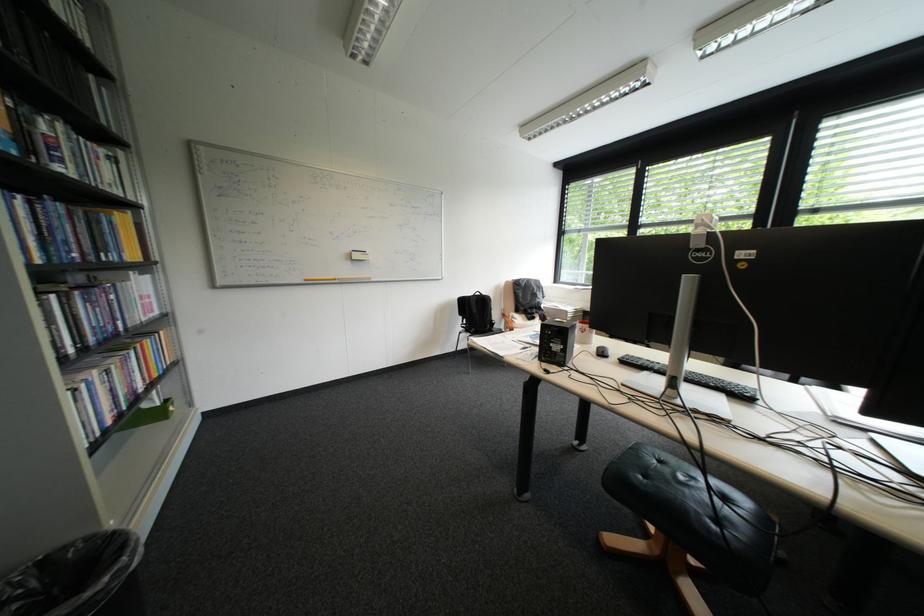
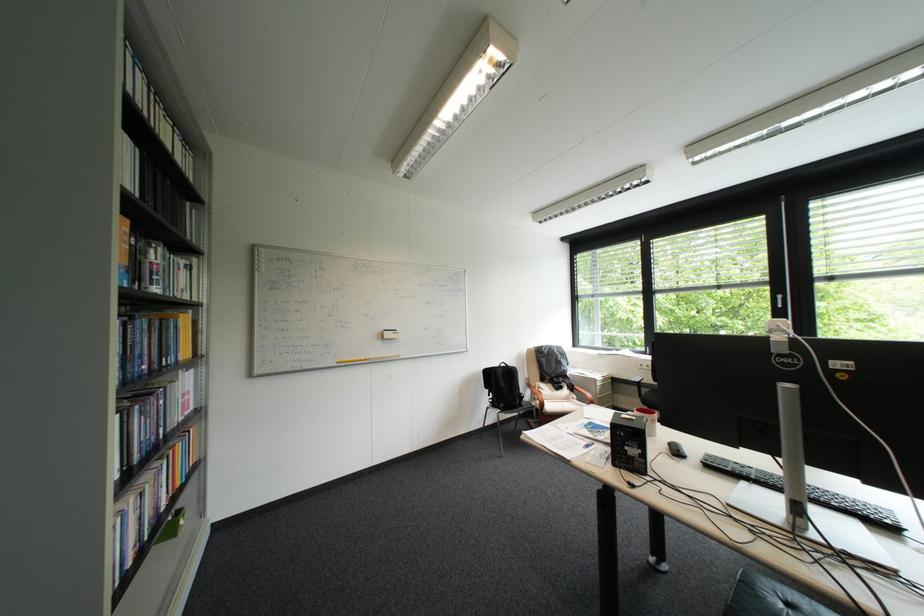
In the second image, find the point that corresponds to [578,312] in the first image.

(608, 379)